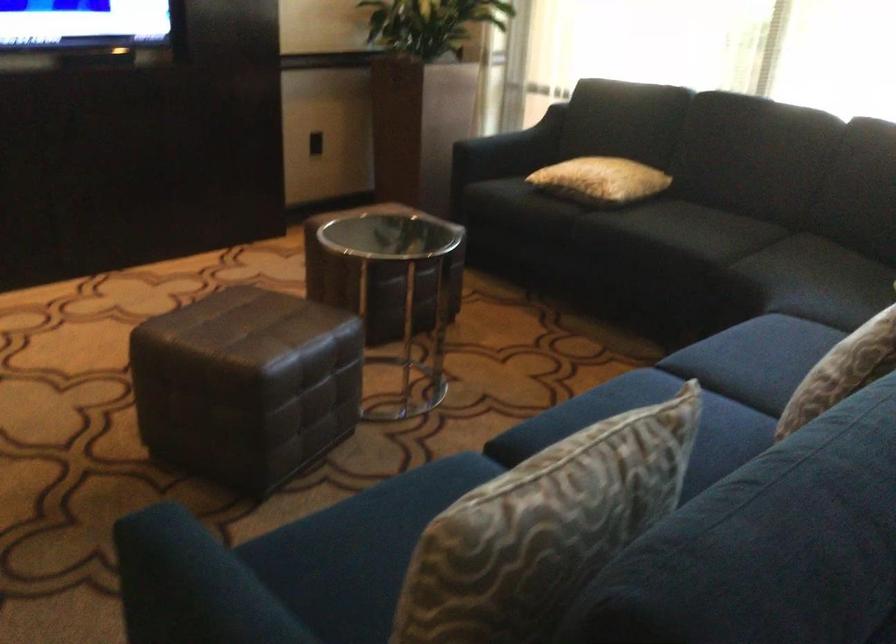
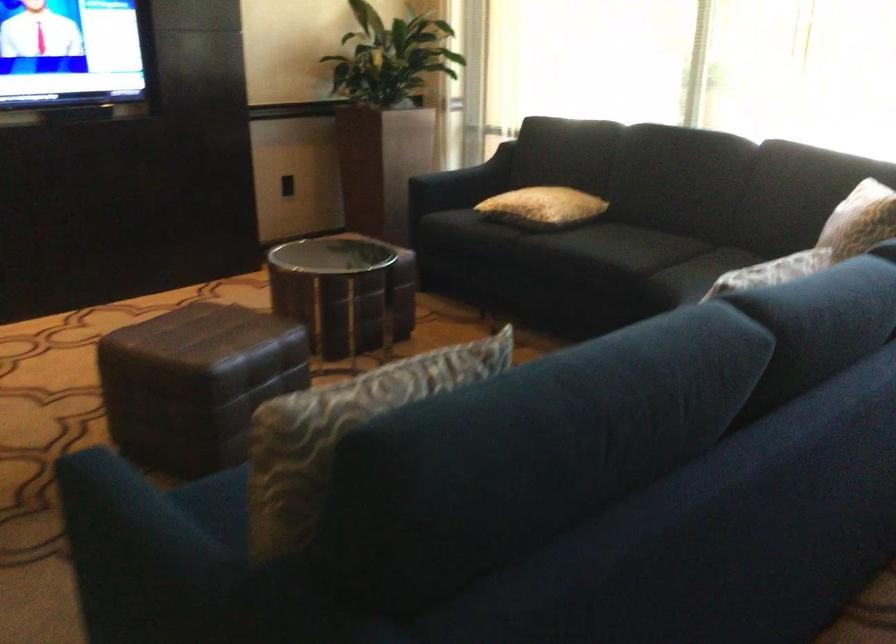
Question: I am providing you with two images of the same scene from different viewpoints. Which of the following objects are not visible in image2?

Choices:
 (A) yellow patterned pillow
 (B) black wall switch
 (C) sofa sitting surface
 (D) none of these

Answer: (D)